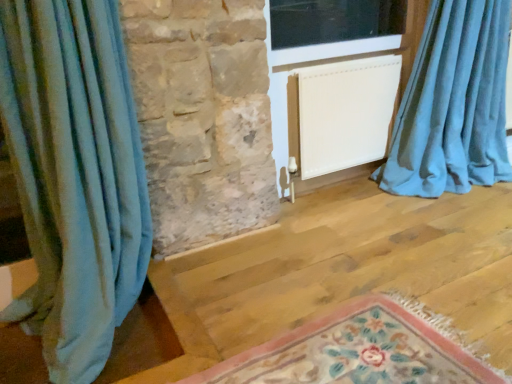
At what (x,y) coordinates should I click in order to perform the action: click on vacant space behind floral rug at lower center. Please return your answer as a coordinate pair (x, y). The image size is (512, 384). Looking at the image, I should click on (317, 265).